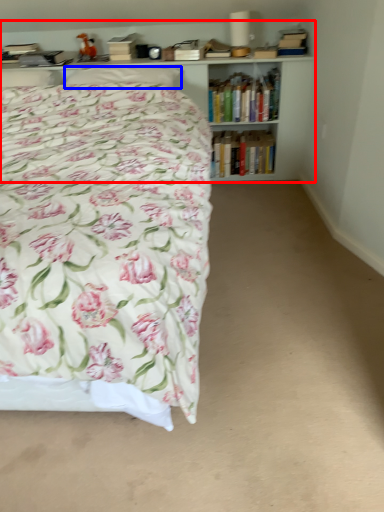
Question: Which of the following is the closest to the observer, bookcase (highlighted by a red box) or pillow (highlighted by a blue box)?

Choices:
 (A) bookcase
 (B) pillow

Answer: (B)